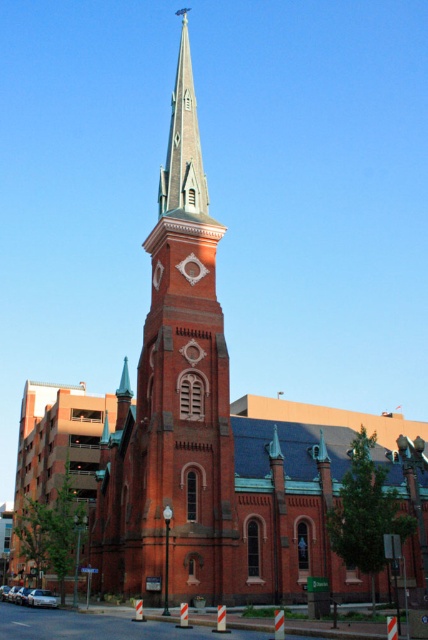
You are standing on the street in front of the church and want to take a photo that includes both the brick steeple at center and the smooth gray steeple at center. Which steeple should you frame closer to the bottom of your camera viewfinder to ensure both are fully visible?

The brick steeple at center is taller than the smooth gray steeple at center. To include both fully in the photo, frame the shorter smooth gray steeple closer to the bottom of the viewfinder so the taller brick steeple doesn t get cut off at the top.

You are a city planner reviewing architectural designs. You notice two steeples in the image, the brick steeple at center and the smooth gray steeple at center. Which one is bigger in size?

The brick steeple at center is larger in size compared to the smooth gray steeple at center.

What are the coordinates of the brick steeple at center in the image?

The brick steeple at center is located at coordinates point (174, 401).